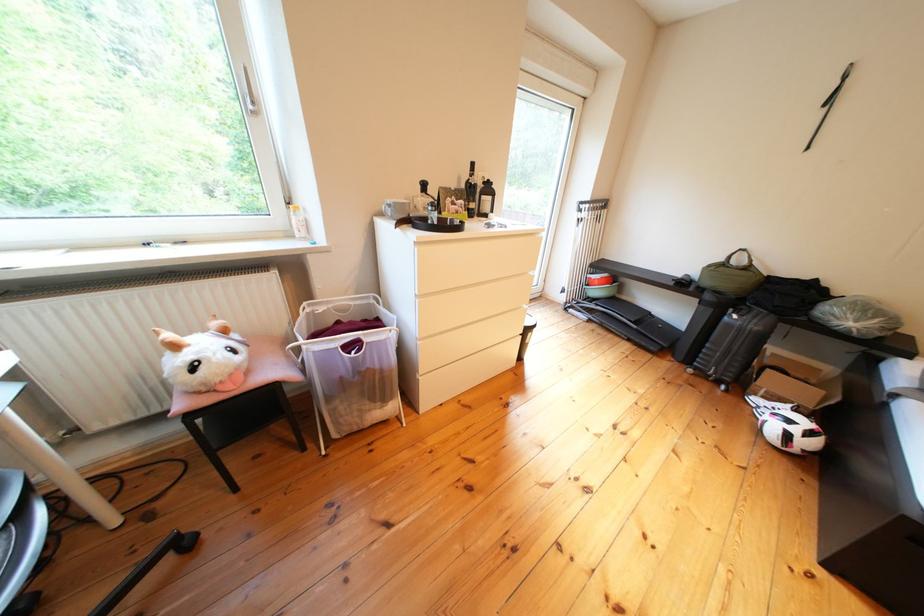
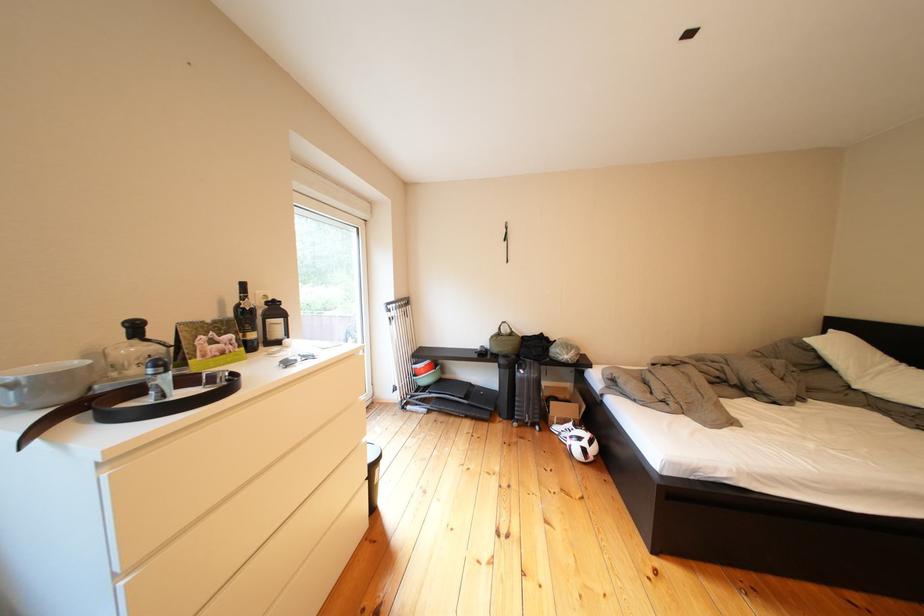
Find the pixel in the second image that matches (744,262) in the first image.

(514, 334)